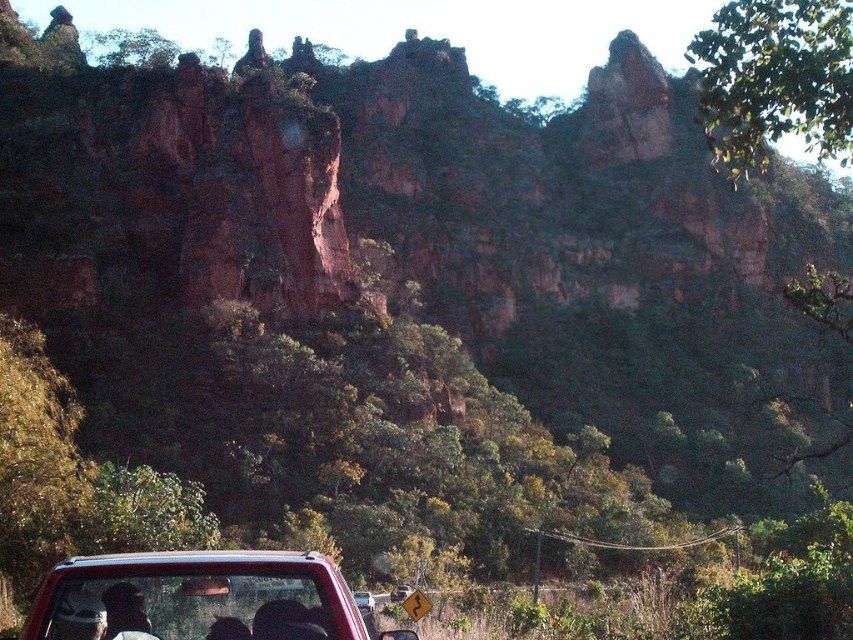
Question: Observing the image, what is the correct spatial positioning of matte red truck at lower center in reference to dark hair at lower center?

Choices:
 (A) left
 (B) right

Answer: (B)

Question: Does dark hair at lower center have a smaller size compared to metallic red car at lower center?

Choices:
 (A) yes
 (B) no

Answer: (A)

Question: Which object appears closest to the camera in this image?

Choices:
 (A) matte red truck at lower center
 (B) dark hair at lower center
 (C) metallic red car at lower center

Answer: (A)

Question: Which object appears farthest from the camera in this image?

Choices:
 (A) matte red truck at lower center
 (B) metallic red car at lower center
 (C) dark hair at lower center

Answer: (B)

Question: Considering the real-world distances, which object is farthest from the metallic red car at lower center?

Choices:
 (A) matte red truck at lower center
 (B) dark hair at lower center

Answer: (A)

Question: Can you confirm if matte red truck at lower center is positioned to the left of metallic red car at lower center?

Choices:
 (A) yes
 (B) no

Answer: (A)